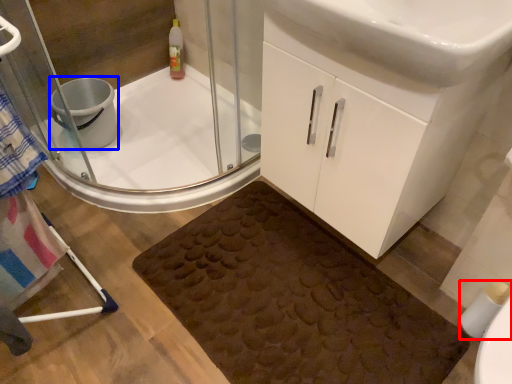
Question: Which point is further to the camera, toilet paper (highlighted by a red box) or toilet bowl (highlighted by a blue box)?

Choices:
 (A) toilet paper
 (B) toilet bowl

Answer: (B)